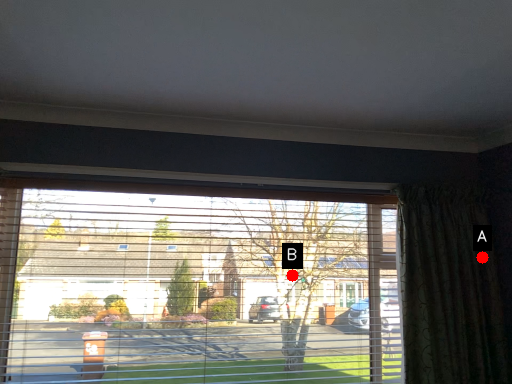
Question: Two points are circled on the image, labeled by A and B beside each circle. Which of the following is the closest to the observer?

Choices:
 (A) A is closer
 (B) B is closer

Answer: (A)